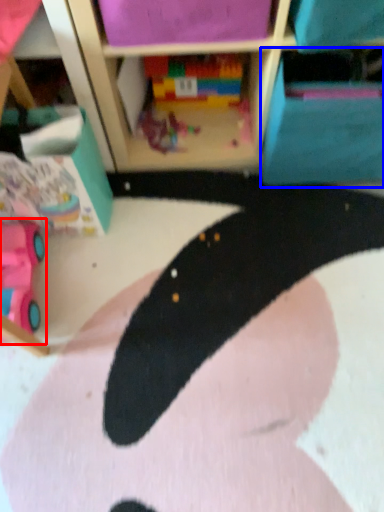
Question: Among these objects, which one is nearest to the camera, toy (highlighted by a red box) or cabinet (highlighted by a blue box)?

Choices:
 (A) toy
 (B) cabinet

Answer: (A)